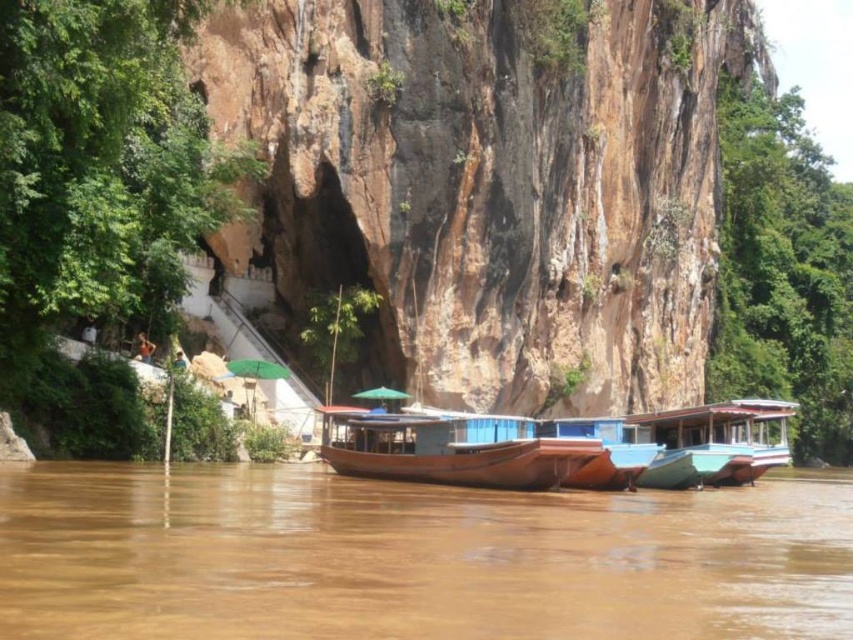
You are standing at the riverside and want to take a photo of the brown rock cliff at center. If your camera has a maximum focus range of 70 meters, will it be able to capture the cliff clearly?

The brown rock cliff at center is 70.29 meters away from the viewer. Since the camera can only focus up to 70 meters, it will not be able to capture the cliff clearly.

You are an environmental scientist assessing the stability of the riverbank. Given the scene, which object between the brown rock cliff at center and the brown wooden boats at center has a greater width, and why?

The brown rock cliff at center has a greater width than the brown wooden boats at center because the description states that the brown rock cliff at center is wider.

You are an environmental scientist assessing the stability of the brown rock cliff at center and the brown wooden boats at center. Based on their heights, which structure is more likely to be visible from a higher elevation point across the river?

The brown rock cliff at center is taller than the brown wooden boats at center, so it would be more likely to be visible from a higher elevation point across the river.